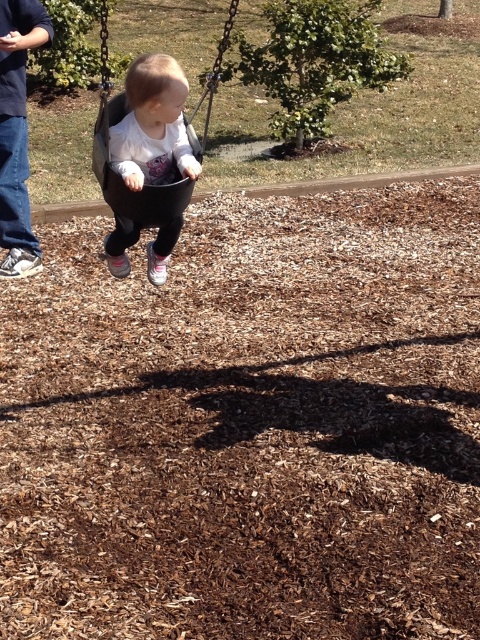
Question: Among these objects, which one is nearest to the camera?

Choices:
 (A) matte black swing at center
 (B) black plastic swing at center

Answer: (A)

Question: Which point is farther to the camera?

Choices:
 (A) black plastic swing at center
 (B) denim pants at left

Answer: (B)

Question: Is matte black swing at center wider than denim pants at left?

Choices:
 (A) no
 (B) yes

Answer: (A)

Question: Which of the following is the farthest from the observer?

Choices:
 (A) matte black swing at center
 (B) black plastic swing at center

Answer: (B)

Question: From the image, what is the correct spatial relationship of denim pants at left in relation to black plastic swing at center?

Choices:
 (A) left
 (B) right

Answer: (A)

Question: Does matte black swing at center have a greater width compared to black plastic swing at center?

Choices:
 (A) no
 (B) yes

Answer: (A)